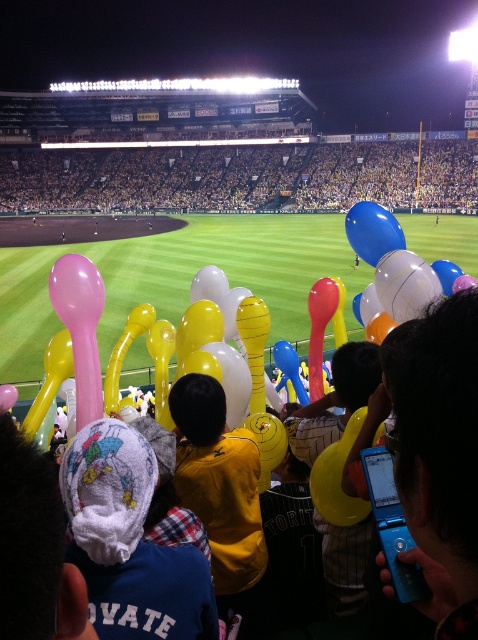
Question: Which of the following is the closest to the observer?

Choices:
 (A) blue plastic flip phone at lower right
 (B) pink rubber spoon at center
 (C) yellow matte shirt at center

Answer: (A)

Question: Estimate the real-world distances between objects in this image. Which object is closer to the pink rubber spoon at center?

Choices:
 (A) blue plastic flip phone at lower right
 (B) yellow balloon at center
 (C) yellow matte shirt at center

Answer: (C)

Question: Does yellow balloon at center have a larger size compared to blue plastic flip phone at lower right?

Choices:
 (A) yes
 (B) no

Answer: (A)

Question: Estimate the real-world distances between objects in this image. Which object is farther from the blue plastic flip phone at lower right?

Choices:
 (A) pink rubber spoon at center
 (B) yellow matte shirt at center

Answer: (A)

Question: Where is yellow matte shirt at center located in relation to blue glossy balloon at center in the image?

Choices:
 (A) below
 (B) above

Answer: (A)

Question: Can you confirm if blue plastic flip phone at lower right is bigger than pink rubber spoon at center?

Choices:
 (A) no
 (B) yes

Answer: (B)